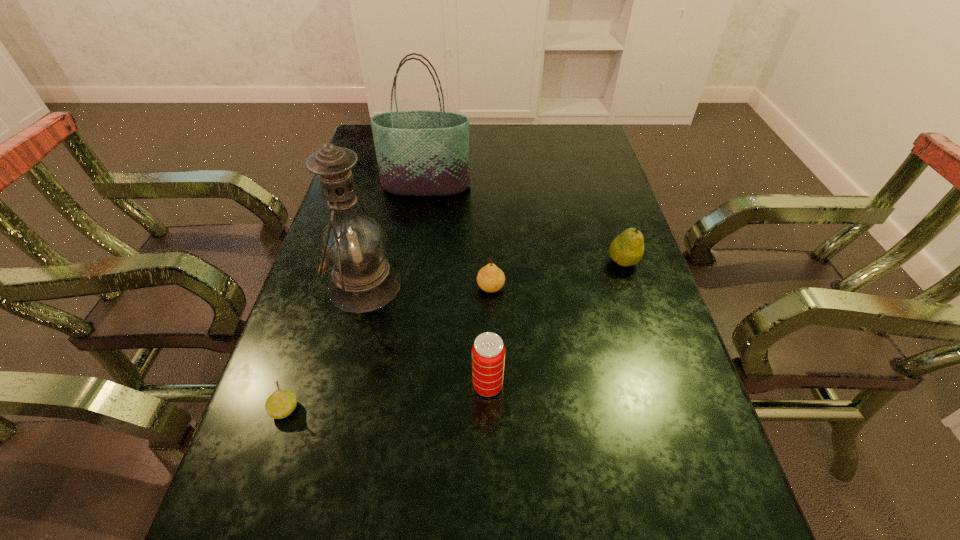
Where is `blank space at the far right corner`? This screenshot has height=540, width=960. blank space at the far right corner is located at coordinates (572, 144).

The width and height of the screenshot is (960, 540). What are the coordinates of `empty space between the soda can and the farthest object` in the screenshot? It's located at (457, 286).

This screenshot has width=960, height=540. Identify the location of vacant point located between the rightmost pear and the nearest pear. (454, 335).

Locate an element on the screen. The image size is (960, 540). free area in between the second pear from left to right and the farthest pear is located at coordinates (557, 274).

Where is `unoccupied area between the farthest object and the second pear from right to left`? unoccupied area between the farthest object and the second pear from right to left is located at coordinates (458, 237).

At what (x,y) coordinates should I click in order to perform the action: click on free area in between the rightmost pear and the farthest object. Please return your answer as a coordinate pair (x, y). The height and width of the screenshot is (540, 960). Looking at the image, I should click on (524, 224).

You are a GUI agent. You are given a task and a screenshot of the screen. Output one action in this format:
    pyautogui.click(x=<x>, y=<y>)
    Task: Click on the free space between the tote bag and the rightmost pear
    This screenshot has width=960, height=540.
    Given the screenshot: What is the action you would take?
    pyautogui.click(x=524, y=224)

At what (x,y) coordinates should I click in order to perform the action: click on the fifth closest object to the tote bag. Please return your answer as a coordinate pair (x, y). Image resolution: width=960 pixels, height=540 pixels. Looking at the image, I should click on (280, 404).

Select which object is the second closest to the second pear from right to left. Please provide its 2D coordinates. Your answer should be formatted as a tuple, i.e. [(x, y)], where the tuple contains the x and y coordinates of a point satisfying the conditions above.

[(488, 351)]

Choose which pear is the nearest neighbor to the rightmost object. Please provide its 2D coordinates. Your answer should be formatted as a tuple, i.e. [(x, y)], where the tuple contains the x and y coordinates of a point satisfying the conditions above.

[(490, 278)]